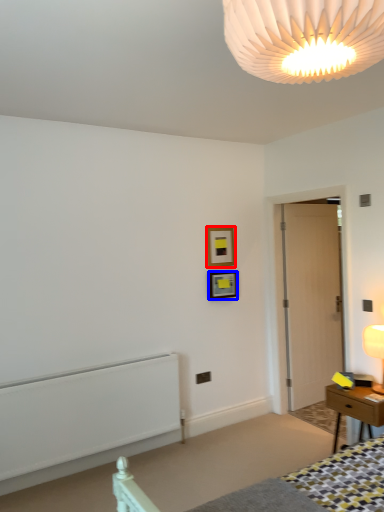
Question: Which of the following is the closest to the observer, picture frame (highlighted by a red box) or picture frame (highlighted by a blue box)?

Choices:
 (A) picture frame
 (B) picture frame

Answer: (B)